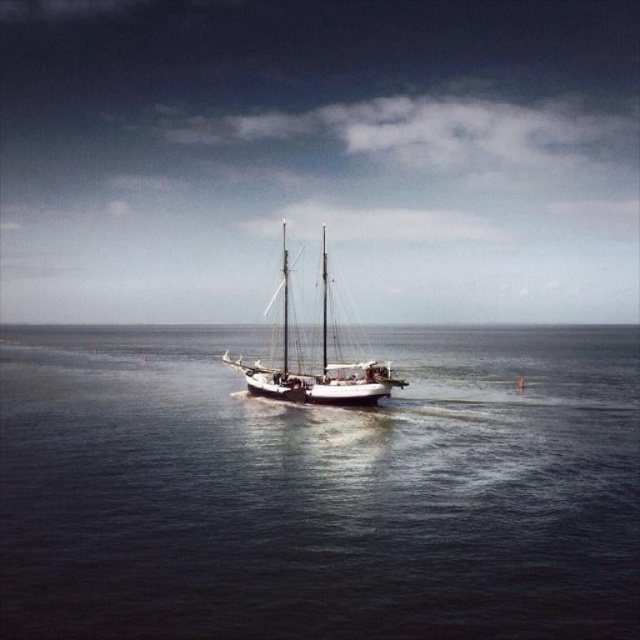
You are on the deck of the sailboat and notice two points marked on the water. The first point is at coordinates point (512, 352) and the second is at point (228, 355). Which point is closer to the direction the boat is moving towards?

Point (228, 355) is closer to the direction the boat is moving towards because it is in front of point (512, 352), which is behind it.

You are an observer standing on a cliff overlooking the maritime scene. You notice the dark blue water at center and the white wooden sailboat at center. Which object appears closer to the horizon line?

The dark blue water at center appears closer to the horizon line because it is shorter than the white wooden sailboat at center, meaning it is positioned further away from the observer.

You are an observer standing on a cliff overlooking the maritime scene. You notice the dark blue water at center and the white wooden sailboat at center. Which object appears smaller in the image?

The dark blue water at center appears smaller than the white wooden sailboat at center in the image.